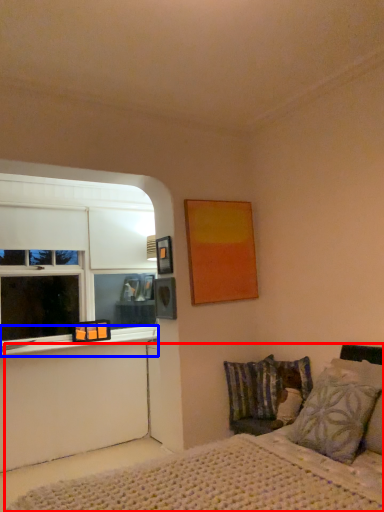
Question: Which of the following is the farthest to the observer, bed (highlighted by a red box) or window sill (highlighted by a blue box)?

Choices:
 (A) bed
 (B) window sill

Answer: (B)